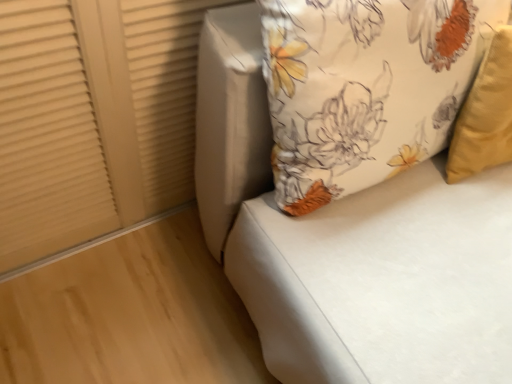
Question: Is floral fabric cushion at upper right bigger or smaller than floral fabric pillow at upper right?

Choices:
 (A) big
 (B) small

Answer: (A)

Question: Considering the positions of floral fabric cushion at upper right and floral fabric pillow at upper right in the image, is floral fabric cushion at upper right taller or shorter than floral fabric pillow at upper right?

Choices:
 (A) short
 (B) tall

Answer: (B)

Question: Estimate the real-world distances between objects in this image. Which object is closer to the matte beige shutter at upper left?

Choices:
 (A) floral fabric cushion at upper right
 (B) floral fabric pillow at upper right

Answer: (A)

Question: Considering the real-world distances, which object is closest to the matte beige shutter at upper left?

Choices:
 (A) floral fabric cushion at upper right
 (B) floral fabric pillow at upper right

Answer: (A)